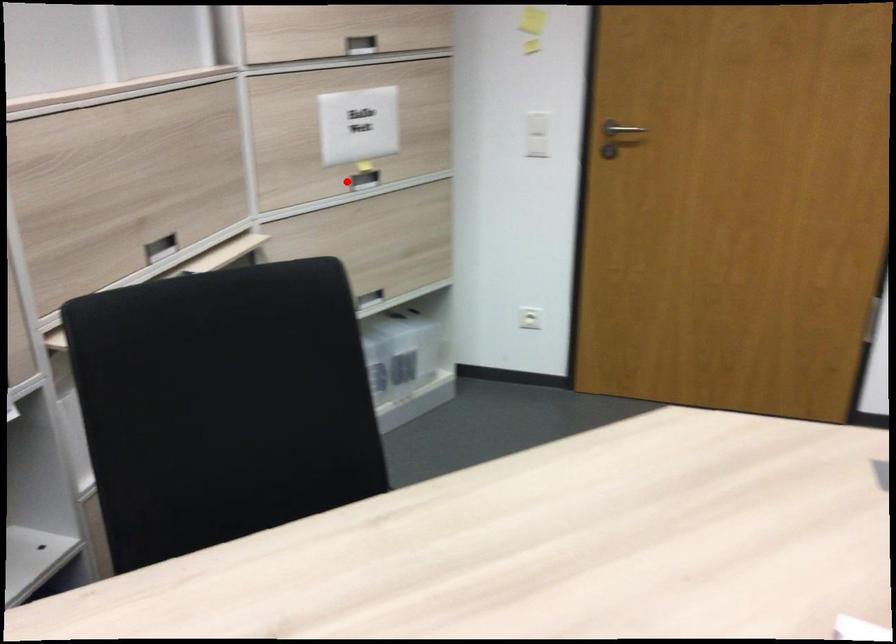
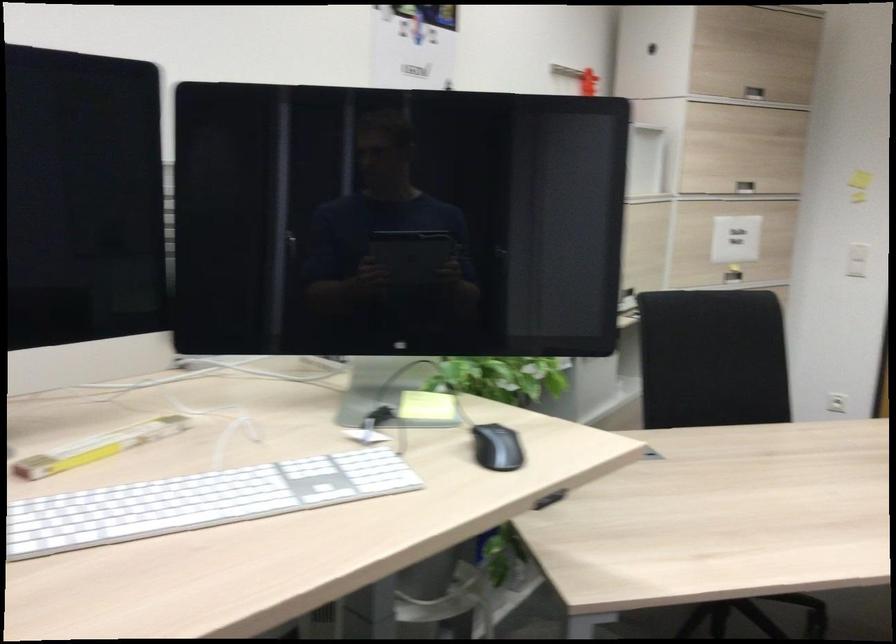
Question: A red point is marked in image1. In image2, is the corresponding 3D point closer to the camera or farther? Reply with the corresponding letter.

Choices:
 (A) The corresponding 3D point is closer.
 (B) The corresponding 3D point is farther.

Answer: (B)